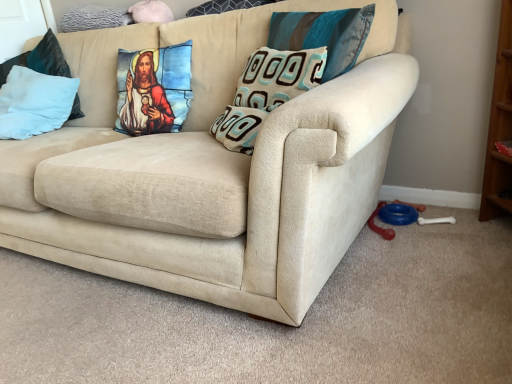
Question: Based on their positions, is beige fabric couch at center located to the left or right of light blue plush pillow at left, which appears as the first pillow when viewed from the left?

Choices:
 (A) left
 (B) right

Answer: (B)

Question: From the image's perspective, is beige fabric couch at center above or below light blue plush pillow at left, the 5th pillow viewed from the right?

Choices:
 (A) below
 (B) above

Answer: (A)

Question: Based on their relative distances, which object is nearer to the teal and brown textured pillow at center, the fourth pillow viewed from the left?

Choices:
 (A) light blue plush pillow at left, the 5th pillow viewed from the right
 (B) teal fabric pillow at upper center, the first pillow from the right
 (C) beige fabric couch at center
 (D) teal fabric pillow at upper center, the 3th pillow in the right-to-left sequence
 (E) printed fabric pillow at center, marked as the 2th pillow in a left-to-right arrangement

Answer: (B)

Question: Considering the real-world distances, which object is closest to the beige fabric couch at center?

Choices:
 (A) teal fabric pillow at upper center, the first pillow from the right
 (B) teal and brown textured pillow at center, the fourth pillow viewed from the left
 (C) light blue plush pillow at left, which appears as the first pillow when viewed from the left
 (D) teal fabric pillow at upper center, which is the 3th pillow from left to right
 (E) printed fabric pillow at center, marked as the 2th pillow in a left-to-right arrangement

Answer: (B)